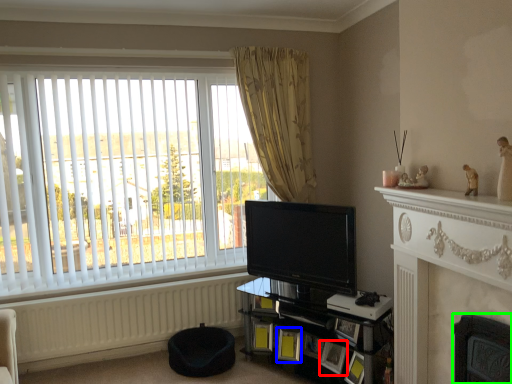
Question: Which object is positioned closest to picture frame (highlighted by a red box)? Select from picture frame (highlighted by a blue box) and fireplace (highlighted by a green box).

Choices:
 (A) picture frame
 (B) fireplace

Answer: (A)